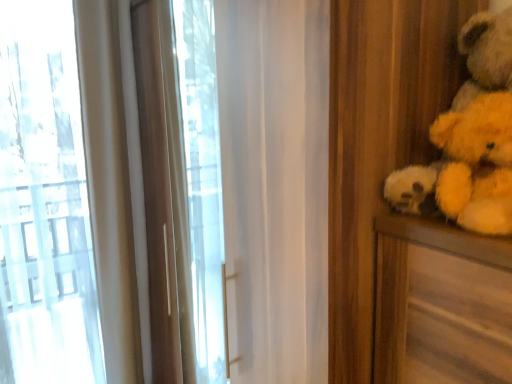
At what (x,y) coordinates should I click in order to perform the action: click on yellow plush bear at right. Please return your answer as a coordinate pair (x, y). The height and width of the screenshot is (384, 512). Looking at the image, I should click on (477, 164).

This screenshot has width=512, height=384. Describe the element at coordinates (477, 164) in the screenshot. I see `yellow plush bear at right` at that location.

Measure the distance between yellow plush bear at right and camera.

A distance of 28.16 inches exists between yellow plush bear at right and camera.

At what (x,y) coordinates should I click in order to perform the action: click on yellow plush teddy bear at right. Please return your answer as a coordinate pair (x, y). Looking at the image, I should click on (470, 139).

Consider the image. Measure the distance between yellow plush teddy bear at right and camera.

yellow plush teddy bear at right and camera are 28.22 inches apart from each other.

Image resolution: width=512 pixels, height=384 pixels. What do you see at coordinates (470, 139) in the screenshot? I see `yellow plush teddy bear at right` at bounding box center [470, 139].

Find the location of a particular element. This screenshot has height=384, width=512. yellow plush bear at right is located at coordinates (477, 164).

From the picture: Which object is positioned more to the right, yellow plush teddy bear at right or yellow plush bear at right?

From the viewer's perspective, yellow plush teddy bear at right appears more on the right side.

Between yellow plush teddy bear at right and yellow plush bear at right, which one is positioned in front?

yellow plush bear at right.

Which point is more distant from viewer, [450,150] or [510,194]?

The point [450,150] is farther from the camera.

From the image's perspective, between yellow plush teddy bear at right and yellow plush bear at right, which one is located above?

yellow plush teddy bear at right, from the image's perspective.

From a real-world perspective, who is located lower, yellow plush teddy bear at right or yellow plush bear at right?

In real-world perspective, yellow plush bear at right is lower.

Considering the relative sizes of yellow plush teddy bear at right and yellow plush bear at right in the image provided, is yellow plush teddy bear at right thinner than yellow plush bear at right?

In fact, yellow plush teddy bear at right might be wider than yellow plush bear at right.

Consider the image. Considering the relative sizes of yellow plush teddy bear at right and yellow plush bear at right in the image provided, is yellow plush teddy bear at right shorter than yellow plush bear at right?

No.

In the scene shown: Is yellow plush teddy bear at right smaller than yellow plush bear at right?

No, yellow plush teddy bear at right is not smaller than yellow plush bear at right.

Is yellow plush teddy bear at right located outside yellow plush bear at right?

Absolutely, yellow plush teddy bear at right is external to yellow plush bear at right.

Is yellow plush teddy bear at right next to yellow plush bear at right and touching it?

Yes, the surface of yellow plush teddy bear at right is in contact with yellow plush bear at right.

Is yellow plush teddy bear at right looking in the opposite direction of yellow plush bear at right?

No, yellow plush teddy bear at right's orientation is not away from yellow plush bear at right.

Can you tell me how much yellow plush teddy bear at right and yellow plush bear at right differ in facing direction?

The facing directions of yellow plush teddy bear at right and yellow plush bear at right are 5.49 degrees apart.

The height and width of the screenshot is (384, 512). Identify the location of teddy bear on the right of yellow plush bear at right. (470, 139).

Considering the relative positions of yellow plush bear at right and yellow plush teddy bear at right in the image provided, is yellow plush bear at right to the right of yellow plush teddy bear at right from the viewer's perspective?

In fact, yellow plush bear at right is to the left of yellow plush teddy bear at right.

Which is in front, yellow plush bear at right or yellow plush teddy bear at right?

yellow plush bear at right is more forward.

Does point (482, 179) come in front of point (479, 129)?

That is False.

From the image's perspective, which one is positioned higher, yellow plush bear at right or yellow plush teddy bear at right?

From the image's view, yellow plush teddy bear at right is above.

From a real-world perspective, is yellow plush bear at right under yellow plush teddy bear at right?

Yes, from a real-world perspective, yellow plush bear at right is below yellow plush teddy bear at right.

Is yellow plush bear at right wider or thinner than yellow plush teddy bear at right?

yellow plush bear at right is thinner than yellow plush teddy bear at right.

Does yellow plush bear at right have a greater height compared to yellow plush teddy bear at right?

Incorrect, the height of yellow plush bear at right is not larger of that of yellow plush teddy bear at right.

Who is smaller, yellow plush bear at right or yellow plush teddy bear at right?

yellow plush bear at right.

Would you say yellow plush bear at right contains yellow plush teddy bear at right?

Actually, yellow plush teddy bear at right is outside yellow plush bear at right.

Is yellow plush bear at right in contact with yellow plush teddy bear at right?

Yes, yellow plush bear at right is right next to yellow plush teddy bear at right and making contact.

Does yellow plush bear at right turn towards yellow plush teddy bear at right?

No, yellow plush bear at right does not turn towards yellow plush teddy bear at right.

Locate an element on the screen. teddy bear above the yellow plush bear at right (from a real-world perspective) is located at coordinates (470, 139).

Where is `teddy bear behind the yellow plush bear at right`? This screenshot has height=384, width=512. teddy bear behind the yellow plush bear at right is located at coordinates (470, 139).

Find the location of `teddy bear above the yellow plush bear at right (from the image's perspective)`. teddy bear above the yellow plush bear at right (from the image's perspective) is located at coordinates (470, 139).